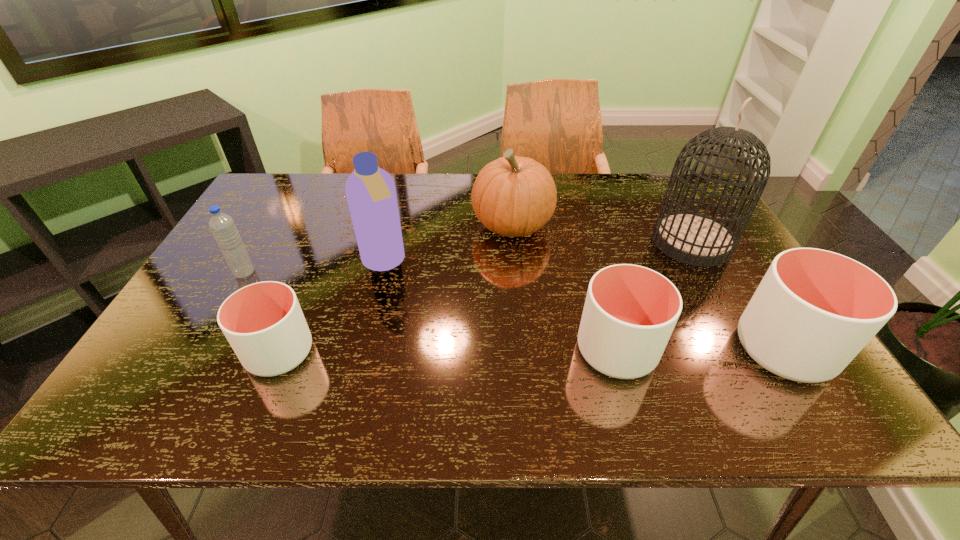
Where is `the leftmost cup`? the leftmost cup is located at coordinates (263, 322).

This screenshot has width=960, height=540. What are the coordinates of `the sixth object from right to left` in the screenshot? It's located at (263, 322).

Where is `the second cup from right to left`? This screenshot has width=960, height=540. the second cup from right to left is located at coordinates (630, 311).

At what (x,y) coordinates should I click in order to perform the action: click on the second tallest cup. Please return your answer as a coordinate pair (x, y). This screenshot has width=960, height=540. Looking at the image, I should click on (630, 311).

Where is `the rightmost cup`? The image size is (960, 540). the rightmost cup is located at coordinates (814, 310).

This screenshot has width=960, height=540. Identify the location of the fifth shortest object. (513, 196).

Find the location of `water bottle`. water bottle is located at coordinates (222, 226).

Find the location of a particular element. the tallest object is located at coordinates pos(692,238).

The height and width of the screenshot is (540, 960). I want to click on shampoo, so click(x=370, y=191).

This screenshot has height=540, width=960. Identify the location of the second tallest object. (370, 191).